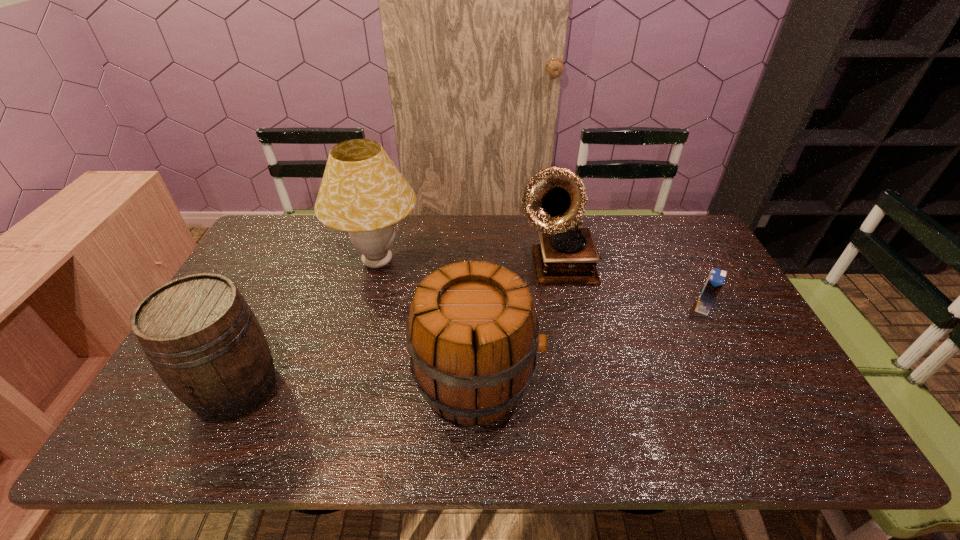
At what (x,y) coordinates should I click in order to perform the action: click on lampshade that is at the far edge. Please return your answer as a coordinate pair (x, y). This screenshot has height=540, width=960. Looking at the image, I should click on (362, 192).

Image resolution: width=960 pixels, height=540 pixels. What are the coordinates of `record player at the far edge` in the screenshot? It's located at (554, 200).

Where is `object present at the left edge`? object present at the left edge is located at coordinates (200, 335).

Locate an element on the screen. object that is at the right edge is located at coordinates (715, 281).

At what (x,y) coordinates should I click in order to perform the action: click on object that is at the near left corner. Please return your answer as a coordinate pair (x, y). This screenshot has width=960, height=540. Looking at the image, I should click on (200, 335).

You are a GUI agent. You are given a task and a screenshot of the screen. Output one action in this format:
    pyautogui.click(x=<x>, y=<y>)
    Task: Click on the free space at the far edge of the desktop
    
    Given the screenshot: What is the action you would take?
    pyautogui.click(x=447, y=221)

Image resolution: width=960 pixels, height=540 pixels. In the image, there is a desktop. Find the location of `vacant space at the near edge`. vacant space at the near edge is located at coordinates (444, 436).

The height and width of the screenshot is (540, 960). In the image, there is a desktop. Find the location of `vacant space at the right edge`. vacant space at the right edge is located at coordinates (715, 265).

Identify the location of vacant area between the right cider and the leftmost object. (356, 384).

Image resolution: width=960 pixels, height=540 pixels. I want to click on vacant space that is in between the leftmost object and the right cider, so click(356, 384).